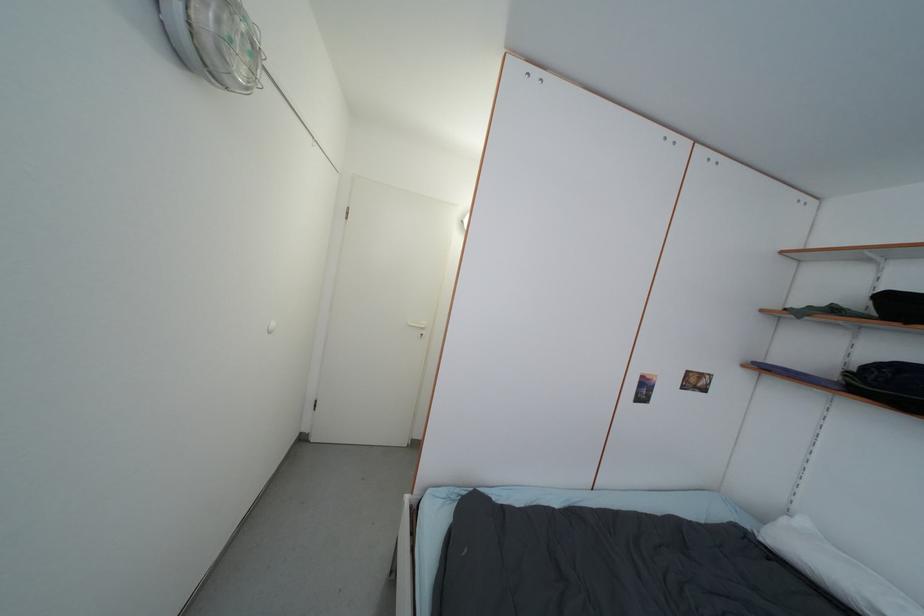
Find where to lift the black bag. Please return your answer as a coordinate pair (x, y).

(891, 377)